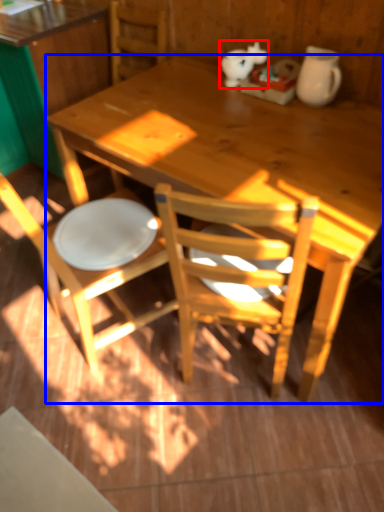
Question: Which of the following is the closest to the observer, animal (highlighted by a red box) or desk (highlighted by a blue box)?

Choices:
 (A) animal
 (B) desk

Answer: (B)